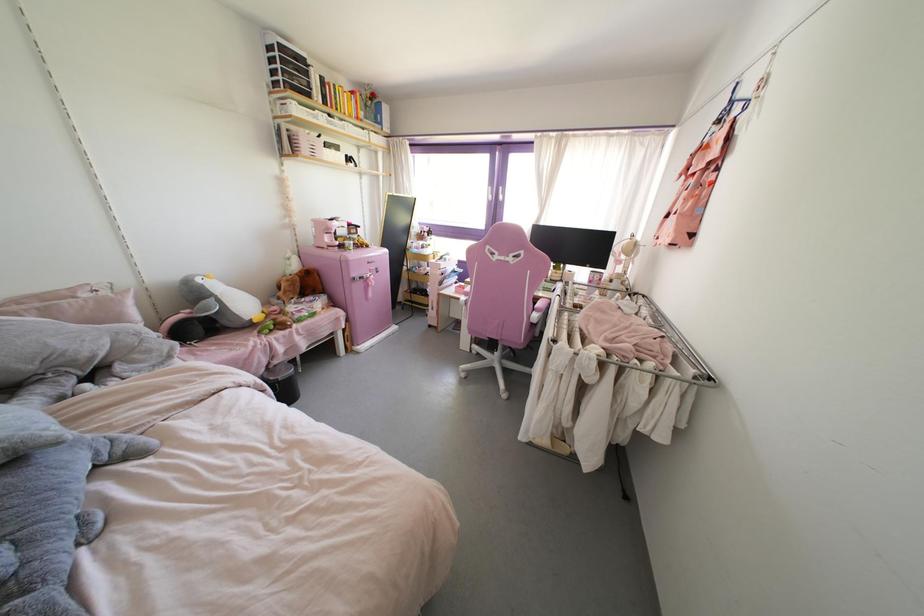
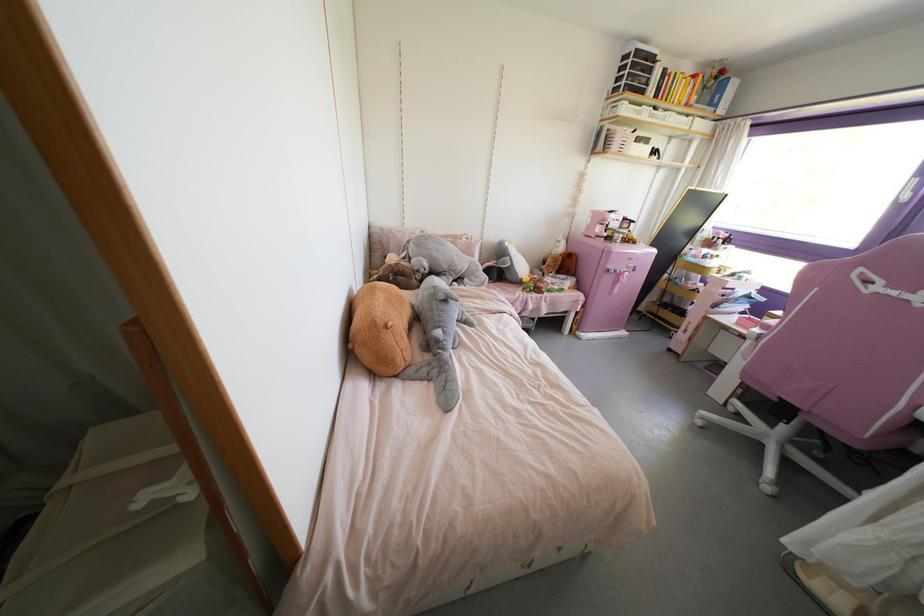
Find the pixel in the second image that matches [169,355] in the first image.

(482, 284)